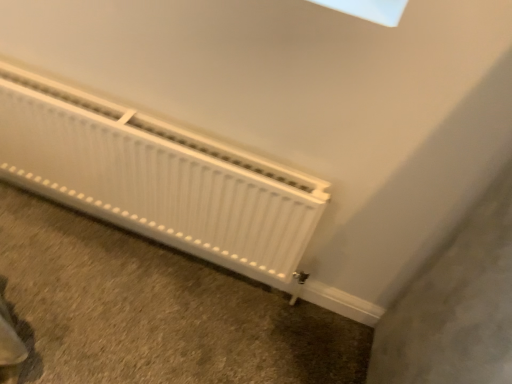
What do you see at coordinates (157, 178) in the screenshot? The image size is (512, 384). I see `white matte radiator at lower left` at bounding box center [157, 178].

Measure the distance between point (19, 139) and camera.

The depth of point (19, 139) is 1.36 meters.

You are a GUI agent. You are given a task and a screenshot of the screen. Output one action in this format:
    pyautogui.click(x=<x>, y=<y>)
    Task: Click on the white matte radiator at lower left
    
    Given the screenshot: What is the action you would take?
    pyautogui.click(x=157, y=178)

Image resolution: width=512 pixels, height=384 pixels. What do you see at coordinates (154, 310) in the screenshot?
I see `white matte radiator at lower left` at bounding box center [154, 310].

Find the location of `white matte radiator at lower left`. white matte radiator at lower left is located at coordinates (154, 310).

Where is `white matte radiator at lower left`? Image resolution: width=512 pixels, height=384 pixels. white matte radiator at lower left is located at coordinates (157, 178).

Which is more to the left, white matte radiator at lower left or white matte radiator at lower left?

white matte radiator at lower left.

In the scene shown: Considering the positions of objects white matte radiator at lower left and white matte radiator at lower left in the image provided, who is behind, white matte radiator at lower left or white matte radiator at lower left?

white matte radiator at lower left is further from the camera.

Which is in front, point (42, 267) or point (66, 165)?

The point (66, 165) is in front.

From the image's perspective, is white matte radiator at lower left positioned above or below white matte radiator at lower left?

From the image's perspective, white matte radiator at lower left appears below white matte radiator at lower left.

From a real-world perspective, is white matte radiator at lower left above or below white matte radiator at lower left?

white matte radiator at lower left is below white matte radiator at lower left.

Between white matte radiator at lower left and white matte radiator at lower left, which one has larger width?

white matte radiator at lower left.

Who is shorter, white matte radiator at lower left or white matte radiator at lower left?

white matte radiator at lower left.

Based on their sizes in the image, would you say white matte radiator at lower left is bigger or smaller than white matte radiator at lower left?

In the image, white matte radiator at lower left appears to be smaller than white matte radiator at lower left.

Would you say white matte radiator at lower left is part of white matte radiator at lower left's contents?

Actually, white matte radiator at lower left is outside white matte radiator at lower left.

Is white matte radiator at lower left not near white matte radiator at lower left?

No, there isn't a large distance between white matte radiator at lower left and white matte radiator at lower left.

Is white matte radiator at lower left turned away from white matte radiator at lower left?

No, white matte radiator at lower left is not facing the opposite direction of white matte radiator at lower left.

How many degrees apart are the facing directions of white matte radiator at lower left and white matte radiator at lower left?

Answer: white matte radiator at lower left and white matte radiator at lower left are facing 89.3 degrees away from each other.

Measure the distance from white matte radiator at lower left to white matte radiator at lower left.

They are 13.76 inches apart.

The image size is (512, 384). Identify the location of concrete to the left of white matte radiator at lower left. (154, 310).

Between white matte radiator at lower left and white matte radiator at lower left, which one appears on the right side from the viewer's perspective?

Positioned to the right is white matte radiator at lower left.

Considering the positions of objects white matte radiator at lower left and white matte radiator at lower left in the image provided, who is behind, white matte radiator at lower left or white matte radiator at lower left?

white matte radiator at lower left is more distant.

Is point (61, 189) positioned after point (59, 348)?

Yes.

From the image's perspective, which is above, white matte radiator at lower left or white matte radiator at lower left?

white matte radiator at lower left is shown above in the image.

From a real-world perspective, does white matte radiator at lower left sit lower than white matte radiator at lower left?

No.

Can you confirm if white matte radiator at lower left is wider than white matte radiator at lower left?

In fact, white matte radiator at lower left might be narrower than white matte radiator at lower left.

Considering the sizes of objects white matte radiator at lower left and white matte radiator at lower left in the image provided, who is shorter, white matte radiator at lower left or white matte radiator at lower left?

white matte radiator at lower left is shorter.

Is white matte radiator at lower left bigger or smaller than white matte radiator at lower left?

Considering their sizes, white matte radiator at lower left takes up more space than white matte radiator at lower left.

Does white matte radiator at lower left contain white matte radiator at lower left?

Actually, white matte radiator at lower left is outside white matte radiator at lower left.

From the picture: Is white matte radiator at lower left with white matte radiator at lower left?

white matte radiator at lower left is not next to white matte radiator at lower left, and they're not touching.

Could you tell me if white matte radiator at lower left is facing white matte radiator at lower left?

Yes, white matte radiator at lower left is facing white matte radiator at lower left.

The height and width of the screenshot is (384, 512). I want to click on concrete on the left of white matte radiator at lower left, so click(x=154, y=310).

The height and width of the screenshot is (384, 512). In the image, there is a white matte radiator at lower left. Identify the location of concrete below it (from a real-world perspective). (154, 310).

This screenshot has height=384, width=512. I want to click on radiator above the white matte radiator at lower left (from a real-world perspective), so click(157, 178).